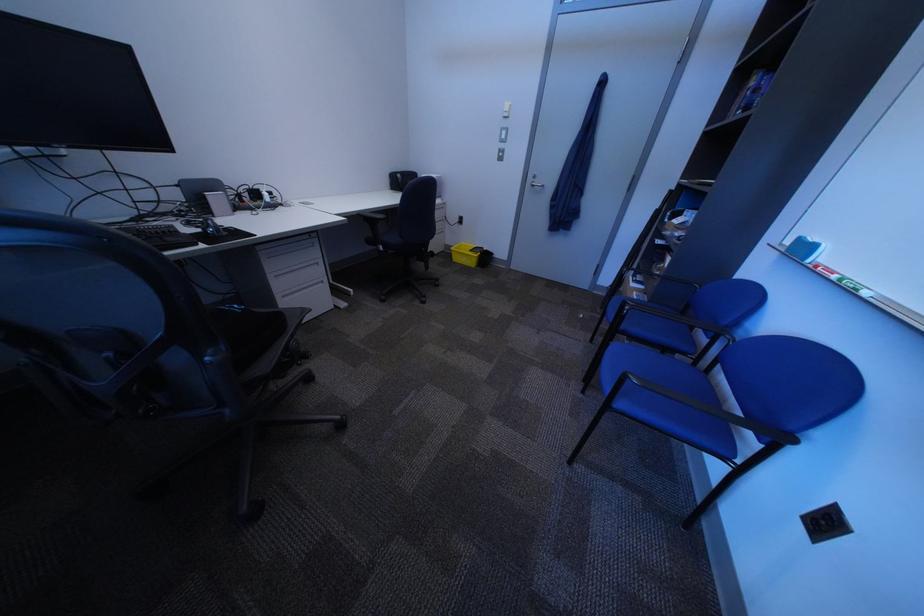
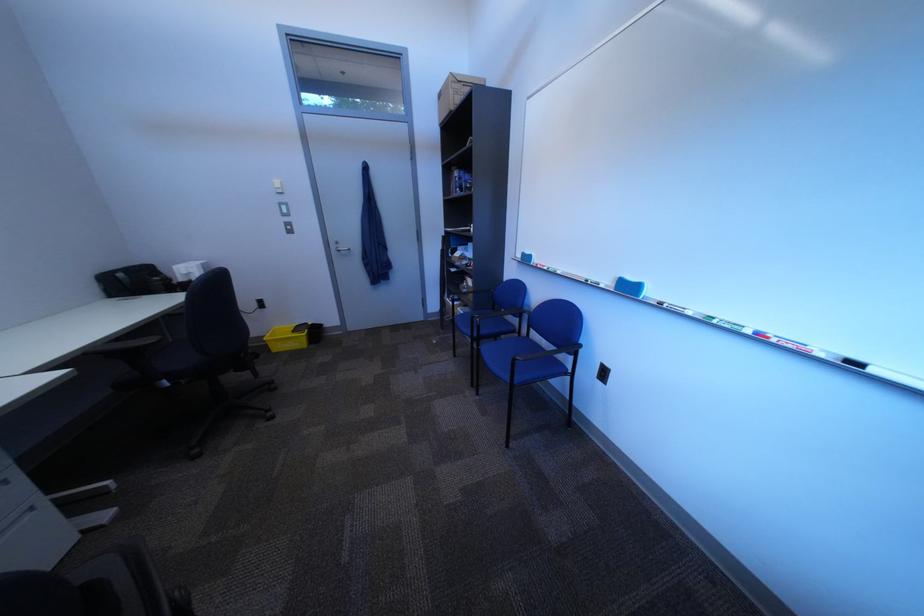
Question: The camera is either moving clockwise (left) or counter-clockwise (right) around the object. The first image is from the beginning of the video and the second image is from the end. Is the camera moving left or right when shooting the video?

Choices:
 (A) Left
 (B) Right

Answer: (A)